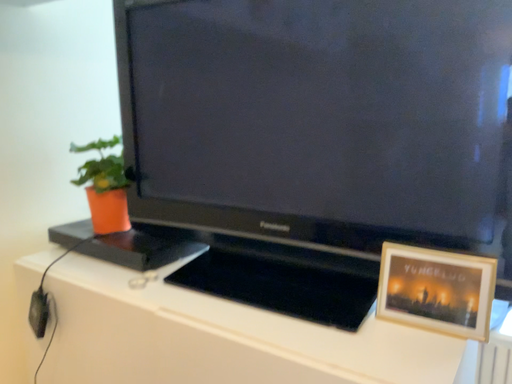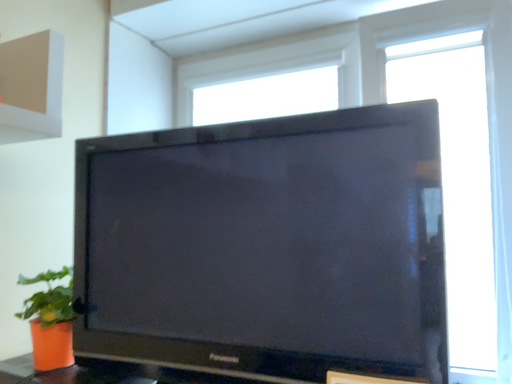
Question: How did the camera likely rotate when shooting the video?

Choices:
 (A) rotated right
 (B) rotated left

Answer: (A)